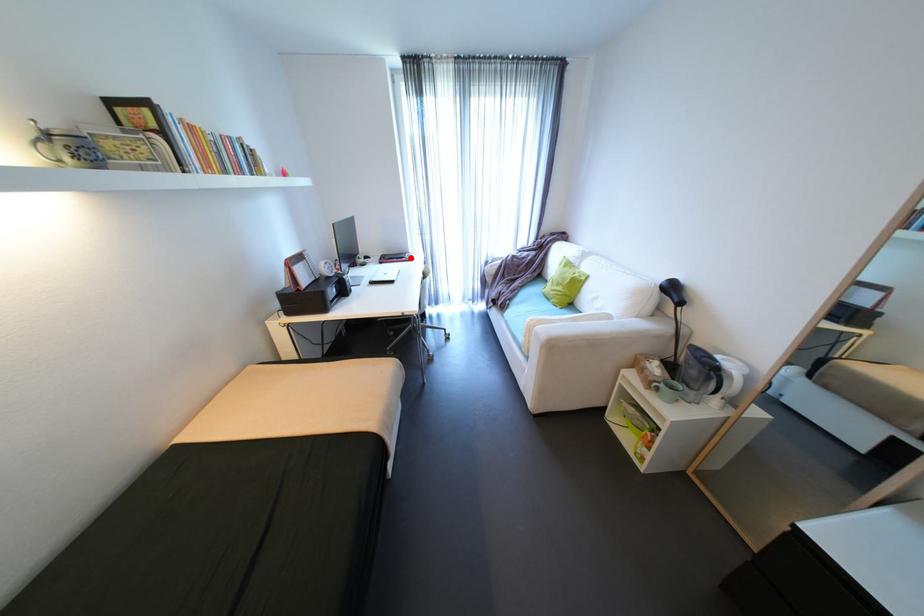
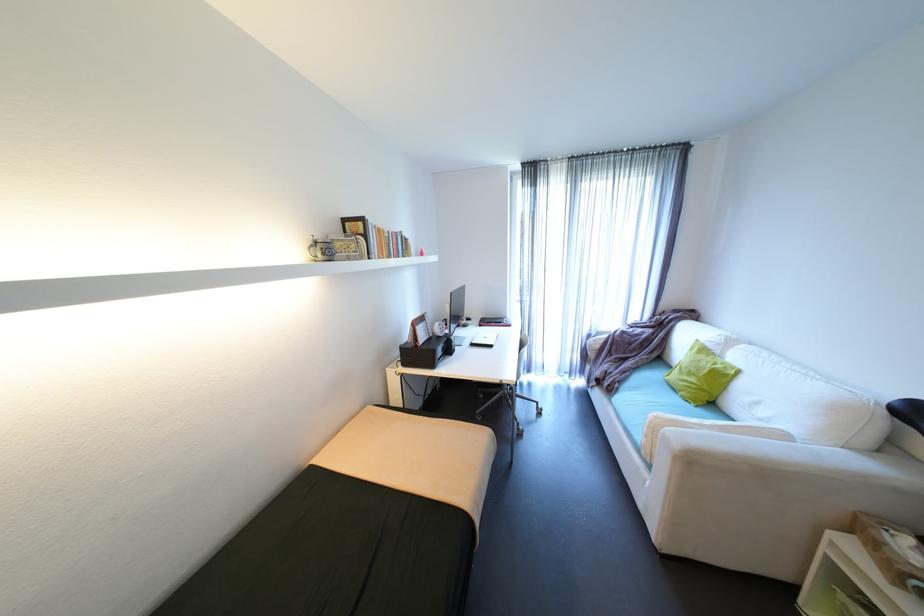
The point at the highlighted location is marked in the first image. Where is the corresponding point in the second image?

(508, 323)